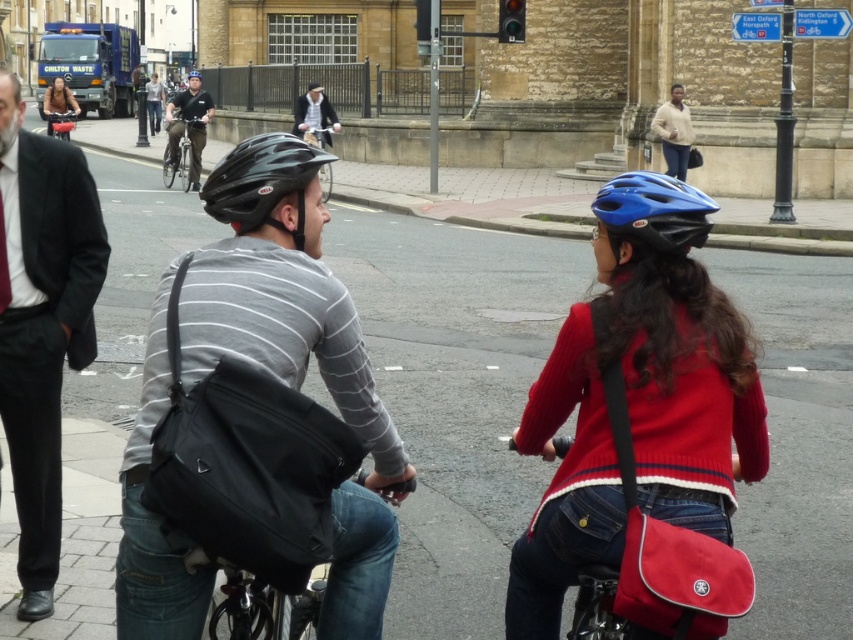
Question: Is light gray striped shirt at center further to the viewer compared to matte black bicycle at upper left?

Choices:
 (A) no
 (B) yes

Answer: (B)

Question: Estimate the real-world distances between objects in this image. Which object is farther from the black matte helmet at center?

Choices:
 (A) shiny black helmet at center
 (B) matte black helmet at upper left

Answer: (B)

Question: Is matte red sweater at center to the left of shiny silver bicycle at upper left from the viewer's perspective?

Choices:
 (A) no
 (B) yes

Answer: (A)

Question: Is red fabric bag at lower right wider than matte black bicycle at upper left?

Choices:
 (A) yes
 (B) no

Answer: (B)

Question: Which of the following is the closest to the observer?

Choices:
 (A) black matte bicycle at center
 (B) matte black bicycle at upper left
 (C) red fabric bag at lower right
 (D) matte black helmet at upper left

Answer: (C)

Question: Which object appears farthest from the camera in this image?

Choices:
 (A) matte red sweater at center
 (B) black matte helmet at center
 (C) matte beige sweater at upper right
 (D) matte black helmet at center

Answer: (C)